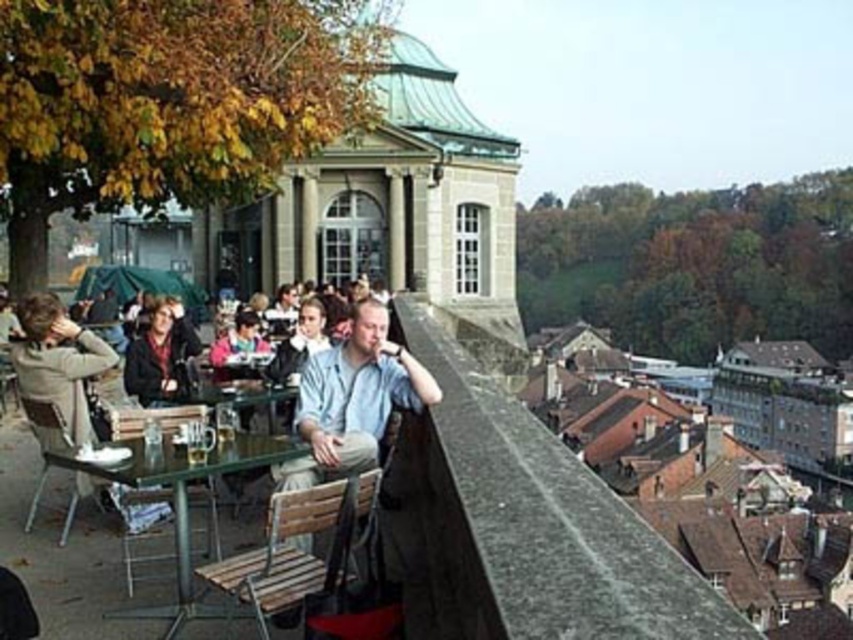
This screenshot has height=640, width=853. Find the location of `light blue fabric shirt at center`. light blue fabric shirt at center is located at coordinates [352, 400].

Is point (386, 394) in front of point (233, 358)?

Yes, it is in front of point (233, 358).

You are a GUI agent. You are given a task and a screenshot of the screen. Output one action in this format:
    pyautogui.click(x=<x>, y=<y>)
    Task: Click on the light blue fabric shirt at center
    
    Given the screenshot: What is the action you would take?
    pyautogui.click(x=352, y=400)

Is light brown leather jacket at lower left positioned at the back of pink fabric jacket at center?

No.

Measure the distance between light brown leather jacket at lower left and pink fabric jacket at center.

light brown leather jacket at lower left and pink fabric jacket at center are 35.99 feet apart.

Is point (32, 307) positioned behind point (241, 372)?

No, (32, 307) is in front of (241, 372).

The image size is (853, 640). Identify the location of light brown leather jacket at lower left. (57, 362).

What do you see at coordinates (184, 504) in the screenshot?
I see `green glass table at center` at bounding box center [184, 504].

Measure the distance from green glass table at center to matte black jacket at center.

A distance of 11.72 meters exists between green glass table at center and matte black jacket at center.

Is point (248, 445) closer to viewer compared to point (169, 324)?

Yes, it is.

Where is `green glass table at center`? green glass table at center is located at coordinates (184, 504).